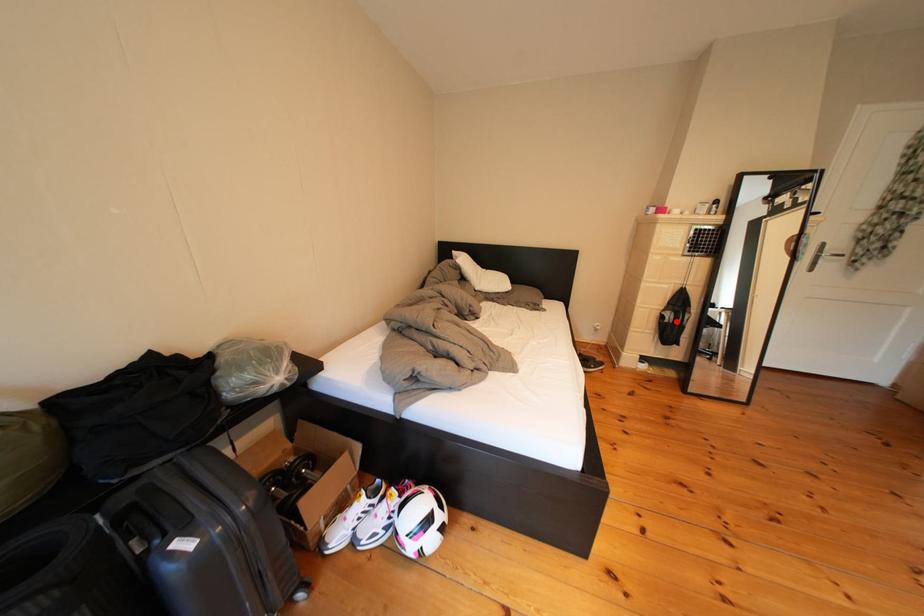
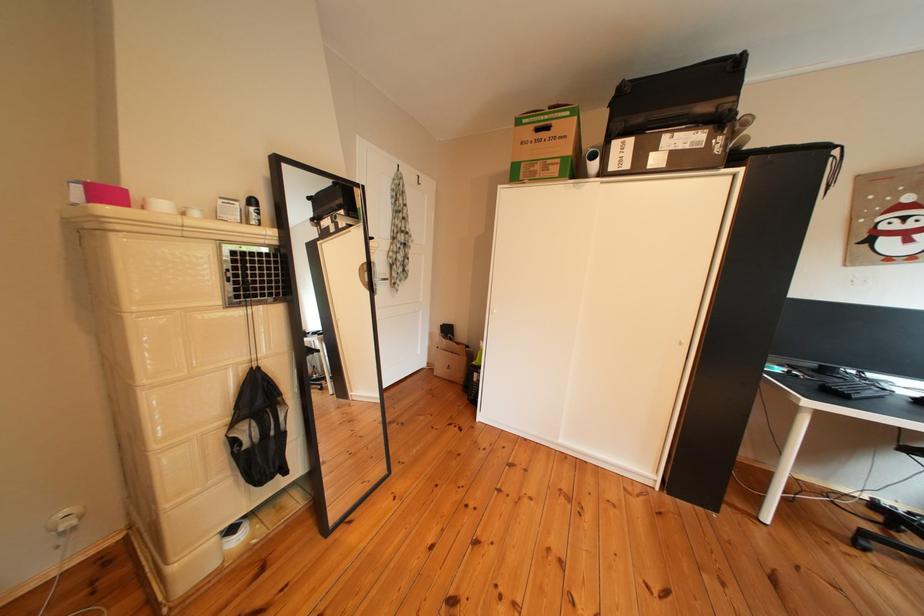
Find the pixel in the second image that matches the highlighted location in the first image.

(249, 447)